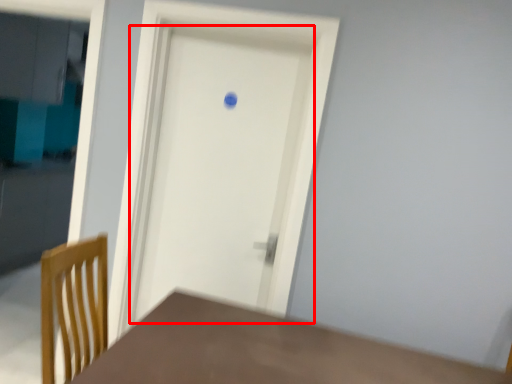
Question: From the image, what is the correct spatial relationship of door (annotated by the red box) in relation to table?

Choices:
 (A) right
 (B) left

Answer: (B)